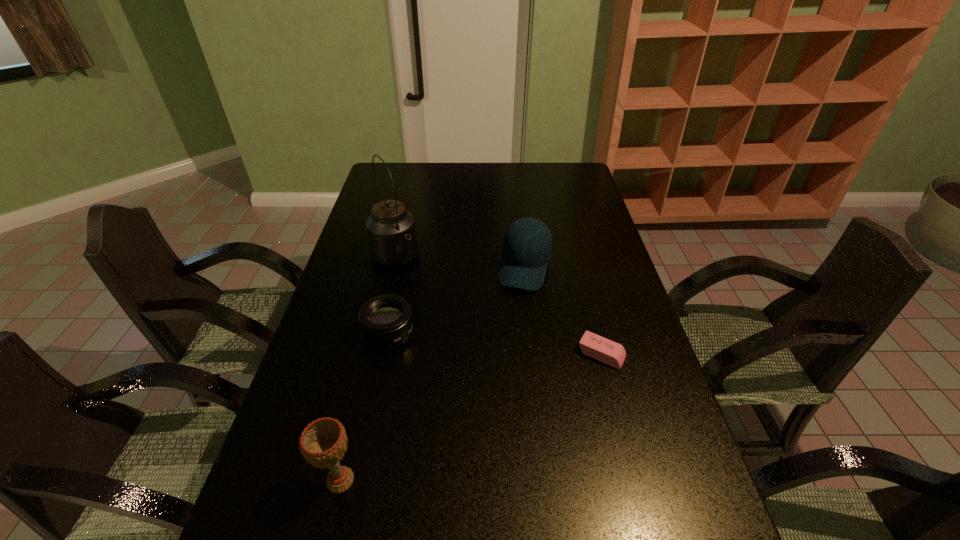
Locate an element on the screen. free space located 0.150m spout on the kettle is located at coordinates (425, 306).

In order to click on vacant space located 0.380m spout on the kettle in this screenshot , I will do `click(465, 358)`.

I want to click on vacant space located spout on the kettle, so click(414, 290).

Locate an element on the screen. The width and height of the screenshot is (960, 540). vacant region located 0.140m on the side of the telephoto lens with brand markings and control switches is located at coordinates (433, 382).

At what (x,y) coordinates should I click in order to perform the action: click on vacant space located on the side of the telephoto lens with brand markings and control switches. Please return your answer as a coordinate pair (x, y). Looking at the image, I should click on (433, 382).

Where is `free space located 0.310m on the side of the telephoto lens with brand markings and control switches`? free space located 0.310m on the side of the telephoto lens with brand markings and control switches is located at coordinates (477, 430).

The image size is (960, 540). I want to click on free space located 0.160m on the front-facing side of the third shortest object, so click(x=511, y=332).

At what (x,y) coordinates should I click in order to perform the action: click on vacant area situated 0.340m on the front-facing side of the third shortest object. Please return your answer as a coordinate pair (x, y). Image resolution: width=960 pixels, height=540 pixels. Looking at the image, I should click on (497, 384).

Locate an element on the screen. free space located 0.390m on the front-facing side of the third shortest object is located at coordinates (492, 401).

This screenshot has height=540, width=960. In order to click on object situated at the near edge in this screenshot , I will do `click(323, 442)`.